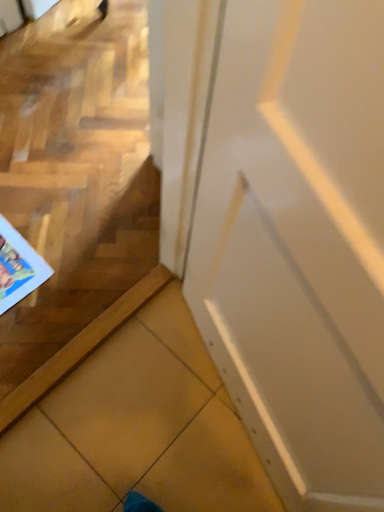
Question: From the image's perspective, would you say matte paper comic book at lower left is positioned over white glossy door at center?

Choices:
 (A) yes
 (B) no

Answer: (A)

Question: Is matte paper comic book at lower left at the right side of white glossy door at center?

Choices:
 (A) no
 (B) yes

Answer: (A)

Question: Is matte paper comic book at lower left facing away from white glossy door at center?

Choices:
 (A) yes
 (B) no

Answer: (B)

Question: From a real-world perspective, does matte paper comic book at lower left stand above white glossy door at center?

Choices:
 (A) no
 (B) yes

Answer: (A)

Question: Would you say white glossy door at center is part of matte paper comic book at lower left's contents?

Choices:
 (A) no
 (B) yes

Answer: (A)

Question: Is matte paper comic book at lower left outside of white glossy door at center?

Choices:
 (A) no
 (B) yes

Answer: (B)

Question: From the image's perspective, does white glossy door at center appear lower than matte paper comic book at lower left?

Choices:
 (A) no
 (B) yes

Answer: (B)

Question: Is white glossy door at center far away from matte paper comic book at lower left?

Choices:
 (A) yes
 (B) no

Answer: (B)

Question: Considering the relative sizes of white glossy door at center and matte paper comic book at lower left in the image provided, is white glossy door at center smaller than matte paper comic book at lower left?

Choices:
 (A) yes
 (B) no

Answer: (B)

Question: Is the depth of white glossy door at center greater than that of matte paper comic book at lower left?

Choices:
 (A) yes
 (B) no

Answer: (B)

Question: Is the depth of white glossy door at center less than that of matte paper comic book at lower left?

Choices:
 (A) no
 (B) yes

Answer: (B)

Question: From a real-world perspective, is white glossy door at center beneath matte paper comic book at lower left?

Choices:
 (A) yes
 (B) no

Answer: (B)

Question: Considering the relative positions of white glossy door at center and matte paper comic book at lower left in the image provided, is white glossy door at center to the left or to the right of matte paper comic book at lower left?

Choices:
 (A) left
 (B) right

Answer: (B)